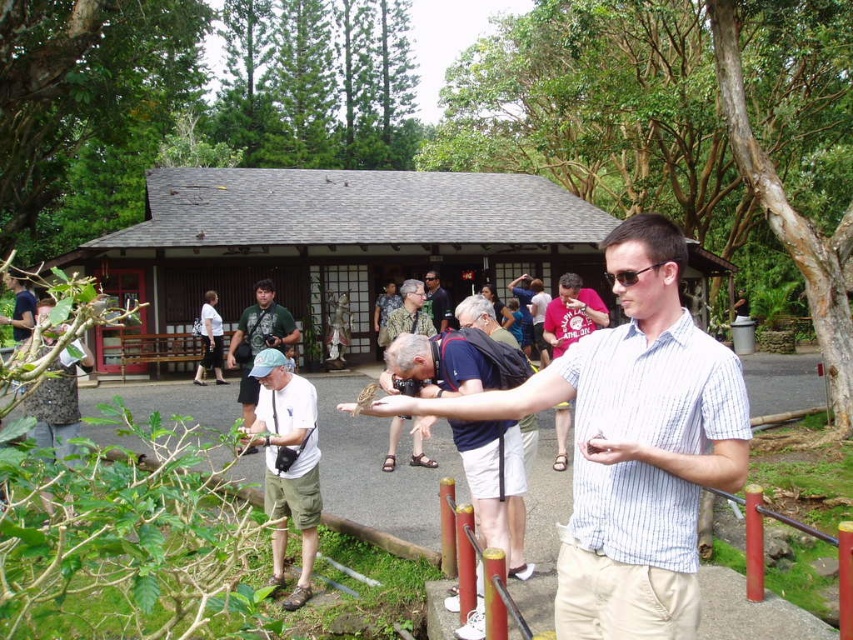
Between blue striped shirt at center and white cotton shirt at center, which one is positioned lower?

white cotton shirt at center is lower down.

Is blue striped shirt at center positioned before white cotton shirt at center?

No.

Which is behind, point (496, 512) or point (270, 516)?

The point (496, 512) is more distant.

At what (x,y) coordinates should I click in order to perform the action: click on blue striped shirt at center. Please return your answer as a coordinate pair (x, y). Image resolution: width=853 pixels, height=640 pixels. Looking at the image, I should click on (456, 362).

Is white cotton shirt at center bigger than matte khaki shorts at center?

Correct, white cotton shirt at center is larger in size than matte khaki shorts at center.

Can you confirm if white cotton shirt at center is positioned below matte khaki shorts at center?

Indeed, white cotton shirt at center is positioned under matte khaki shorts at center.

You are a GUI agent. You are given a task and a screenshot of the screen. Output one action in this format:
    pyautogui.click(x=<x>, y=<y>)
    Task: Click on the white cotton shirt at center
    This screenshot has width=853, height=640.
    Given the screenshot: What is the action you would take?
    coord(287,464)

In order to click on white cotton shirt at center in this screenshot , I will do `click(287, 464)`.

Does white striped shirt at center have a greater height compared to striped cotton shirt at center?

Yes, white striped shirt at center is taller than striped cotton shirt at center.

Between white striped shirt at center and striped cotton shirt at center, which one has more height?

white striped shirt at center

The height and width of the screenshot is (640, 853). Describe the element at coordinates (631, 444) in the screenshot. I see `white striped shirt at center` at that location.

I want to click on white striped shirt at center, so click(x=631, y=444).